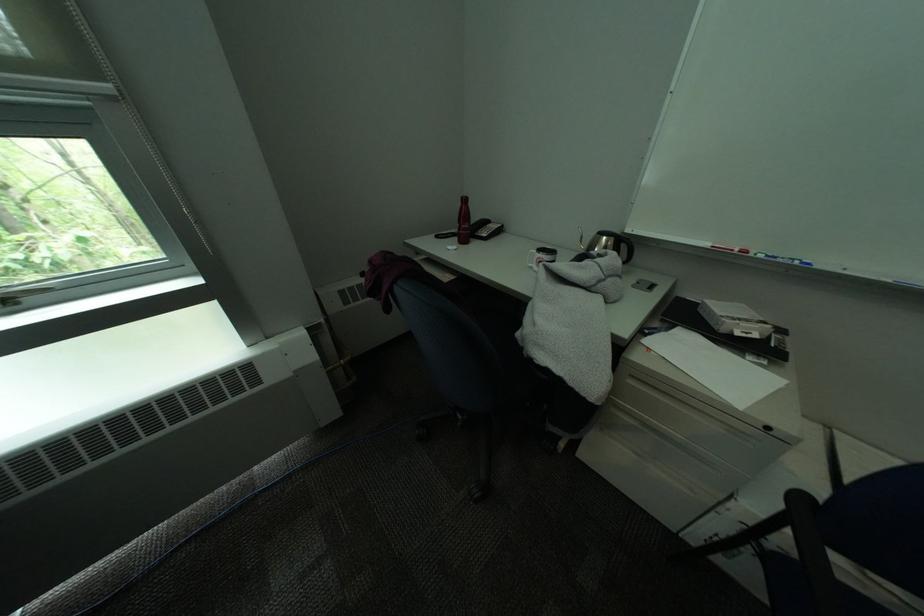
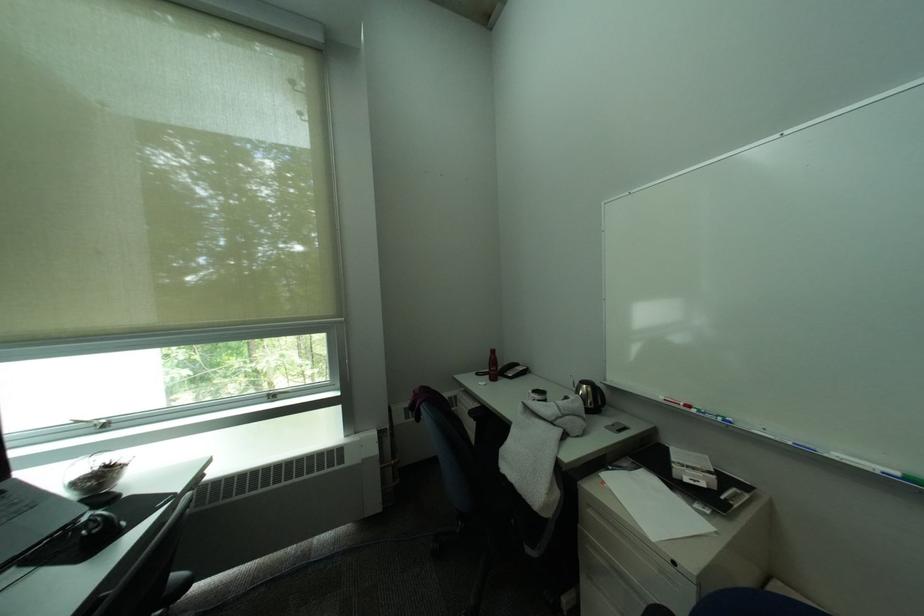
The point at (475, 228) is marked in the first image. Where is the corresponding point in the second image?

(503, 370)